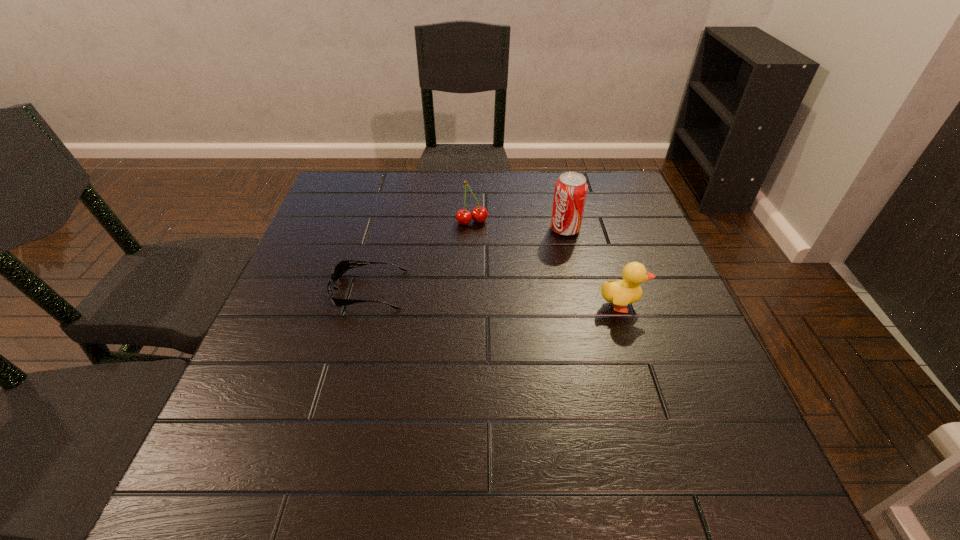
You are a GUI agent. You are given a task and a screenshot of the screen. Output one action in this format:
    pyautogui.click(x=<x>, y=<y>)
    Task: Click on the vacant space in between the duckling and the shortest object
    
    Given the screenshot: What is the action you would take?
    pyautogui.click(x=495, y=298)

Image resolution: width=960 pixels, height=540 pixels. I want to click on free space that is in between the cherry and the duckling, so click(x=546, y=264).

Where is `unoccupied area between the duckling and the sunglasses`? This screenshot has height=540, width=960. unoccupied area between the duckling and the sunglasses is located at coordinates (495, 298).

Find the location of a particular element. The height and width of the screenshot is (540, 960). vacant area that lies between the cherry and the shortest object is located at coordinates (420, 256).

Locate an element on the screen. free space between the cherry and the shortest object is located at coordinates (420, 256).

This screenshot has width=960, height=540. Find the location of `free space between the tallest object and the duckling`. free space between the tallest object and the duckling is located at coordinates (593, 267).

Identify the location of free space between the soda can and the duckling. coord(593,267).

The height and width of the screenshot is (540, 960). In order to click on empty location between the duckling and the leftmost object in this screenshot , I will do `click(495, 298)`.

Locate an element on the screen. This screenshot has width=960, height=540. vacant space in between the cherry and the tallest object is located at coordinates (518, 226).

Identify the location of vacant point located between the soda can and the cherry. (518, 226).